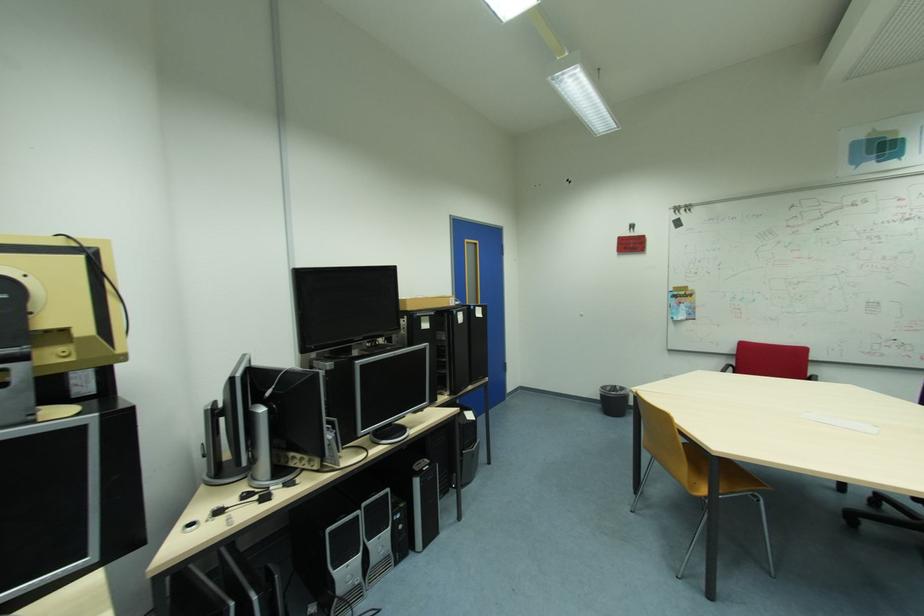
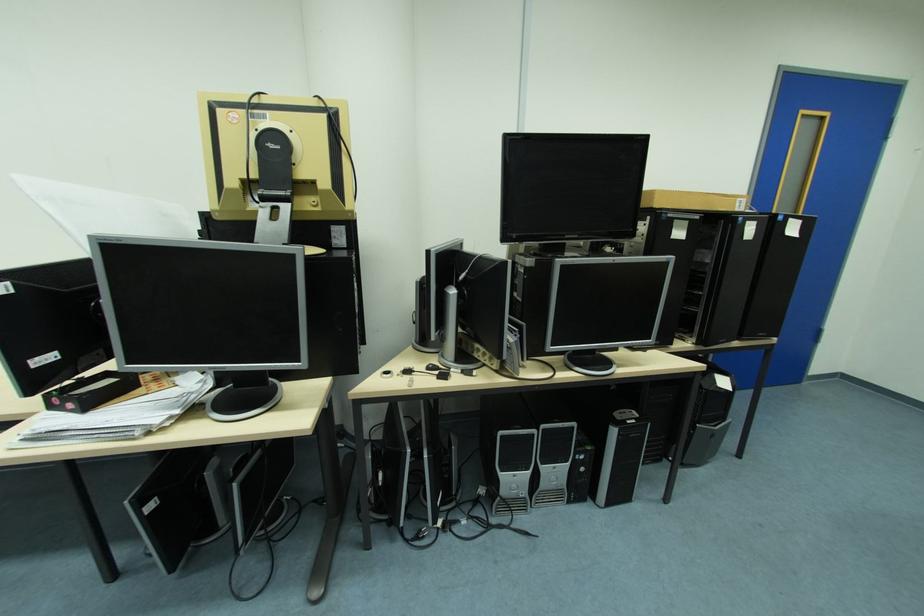
Locate, in the second image, the point that corresponds to (424,482) in the first image.

(621, 432)